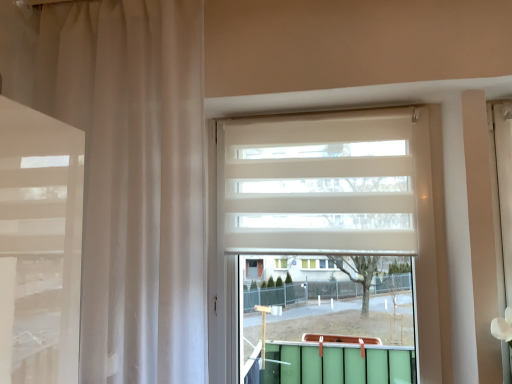
The width and height of the screenshot is (512, 384). Identify the location of white matte blind at center. (320, 198).

Locate an element on the screen. white matte window at center is located at coordinates (332, 240).

Locate an element on the screen. white matte blind at center is located at coordinates (320, 198).

Is sheer white curtain at left looking in the opposite direction of white matte blind at center?

No, sheer white curtain at left is not facing away from white matte blind at center.

From the picture: Based on their positions, is sheer white curtain at left located to the left or right of white matte blind at center?

From the image, it's evident that sheer white curtain at left is to the left of white matte blind at center.

Does sheer white curtain at left have a lesser height compared to white matte blind at center?

Incorrect, the height of sheer white curtain at left does not fall short of that of white matte blind at center.

Would you say white matte window at center is to the left or to the right of sheer white curtain at left in the picture?

In the image, white matte window at center appears on the right side of sheer white curtain at left.

Is white matte window at center far from sheer white curtain at left?

white matte window at center is actually quite close to sheer white curtain at left.

Is white matte window at center inside or outside of sheer white curtain at left?

The correct answer is: outside.

Consider the image. Between white matte window at center and sheer white curtain at left, which one has less height?

Standing shorter between the two is white matte window at center.

How many degrees apart are the facing directions of white matte blind at center and white matte window at center?

3.72 degrees separate the facing orientations of white matte blind at center and white matte window at center.

Between white matte blind at center and white matte window at center, which one appears on the left side from the viewer's perspective?

From the viewer's perspective, white matte blind at center appears more on the left side.

Is white matte blind at center beside white matte window at center?

Yes, white matte blind at center is touching white matte window at center.

Is white matte blind at center in front of or behind white matte window at center in the image?

white matte blind at center is behind white matte window at center.

Does white matte window at center have a greater width compared to white matte blind at center?

Yes, white matte window at center is wider than white matte blind at center.

From a real-world perspective, is white matte window at center physically located above or below white matte blind at center?

From a real-world perspective, white matte window at center is physically below white matte blind at center.

Can you confirm if white matte window at center is bigger than white matte blind at center?

Indeed, white matte window at center has a larger size compared to white matte blind at center.

Is point (346, 179) closer to camera compared to point (70, 57)?

That is False.

Based on the photo, what's the angular difference between white matte blind at center and sheer white curtain at left's facing directions?

The angle between the facing direction of white matte blind at center and the facing direction of sheer white curtain at left is 1.93 degrees.

Where is `curtain located in front of the white matte blind at center`? The width and height of the screenshot is (512, 384). curtain located in front of the white matte blind at center is located at coordinates (128, 172).

From a real-world perspective, is sheer white curtain at left below white matte window at center?

→ No, from a real-world perspective, sheer white curtain at left is not below white matte window at center.

Find the location of a particular element. The width and height of the screenshot is (512, 384). window below the sheer white curtain at left (from a real-world perspective) is located at coordinates (332, 240).

Would you consider sheer white curtain at left to be distant from white matte window at center?

They are positioned close to each other.

From the picture: Is sheer white curtain at left bigger or smaller than white matte window at center?

sheer white curtain at left is bigger than white matte window at center.

The width and height of the screenshot is (512, 384). I want to click on blind located above the sheer white curtain at left (from a real-world perspective), so [x=320, y=198].

Locate an element on the screen. This screenshot has height=384, width=512. window that appears below the sheer white curtain at left (from a real-world perspective) is located at coordinates (332, 240).

Looking at the image, which one is located closer to white matte blind at center, white matte window at center or sheer white curtain at left?

white matte window at center is positioned closer to the anchor white matte blind at center.

When comparing their distances from white matte window at center, does sheer white curtain at left or white matte blind at center seem further?

Based on the image, sheer white curtain at left appears to be further to white matte window at center.

From the image, which object appears to be nearer to sheer white curtain at left, white matte blind at center or white matte window at center?

Among the two, white matte window at center is located nearer to sheer white curtain at left.

From the image, which object appears to be farther from sheer white curtain at left, white matte window at center or white matte blind at center?

The object further to sheer white curtain at left is white matte blind at center.

When comparing their distances from white matte window at center, does white matte blind at center or sheer white curtain at left seem closer?

Among the two, white matte blind at center is located nearer to white matte window at center.

In the scene shown: Which object lies further to the anchor point white matte blind at center, sheer white curtain at left or white matte window at center?

The object further to white matte blind at center is sheer white curtain at left.

Locate an element on the screen. The image size is (512, 384). blind situated between sheer white curtain at left and white matte window at center from left to right is located at coordinates (320, 198).